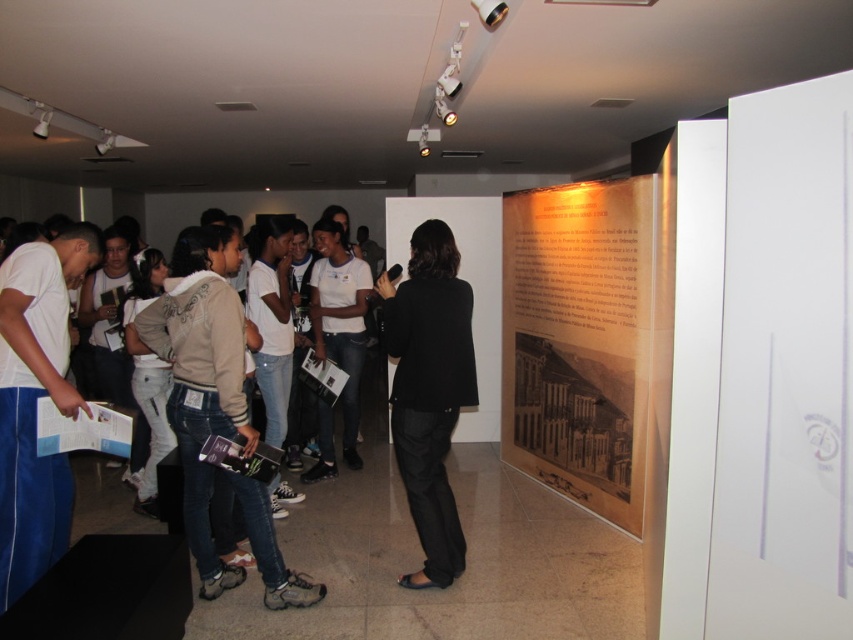
Question: Does brown paper poster at center appear over black matte blazer at center?

Choices:
 (A) yes
 (B) no

Answer: (A)

Question: Can you confirm if brown paper poster at center is thinner than black matte blazer at center?

Choices:
 (A) no
 (B) yes

Answer: (A)

Question: Which point is farther from the camera taking this photo?

Choices:
 (A) (515, 192)
 (B) (412, 280)

Answer: (A)

Question: Which of the following is the closest to the observer?

Choices:
 (A) brown paper poster at center
 (B) black matte blazer at center

Answer: (B)

Question: Considering the relative positions of brown paper poster at center and black matte blazer at center in the image provided, where is brown paper poster at center located with respect to black matte blazer at center?

Choices:
 (A) below
 (B) above

Answer: (B)